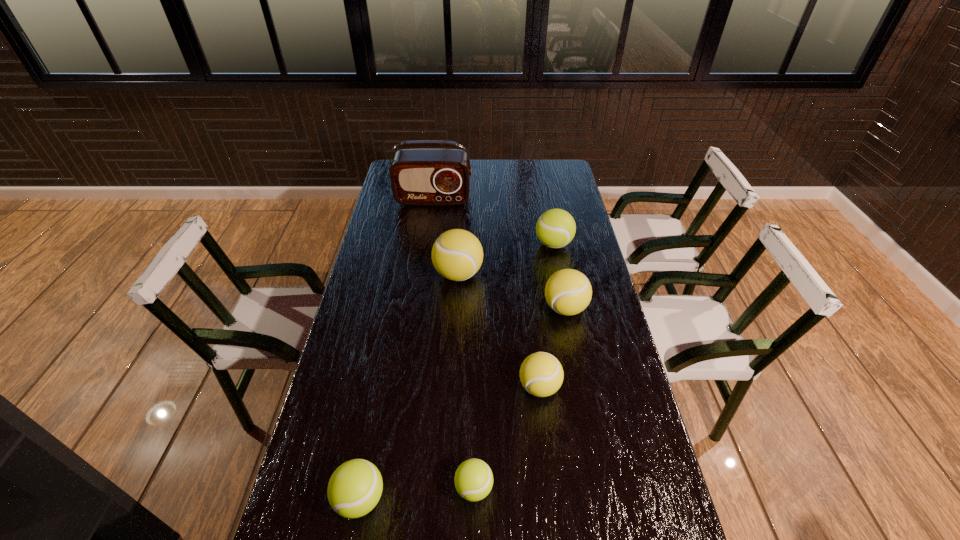
The image size is (960, 540). What are the coordinates of `vacant space situated on the right of the second green tennis ball from left to right` in the screenshot? It's located at (548, 488).

Locate an element on the screen. The height and width of the screenshot is (540, 960). radio receiver located in the left edge section of the desktop is located at coordinates (425, 177).

Find the location of a particular element. This screenshot has height=540, width=960. tennis ball that is positioned at the left edge is located at coordinates (354, 489).

The image size is (960, 540). I want to click on vacant space at the far edge of the desktop, so click(477, 175).

Locate an element on the screen. This screenshot has height=540, width=960. vacant space at the left edge is located at coordinates (401, 215).

Identify the location of vacant area at the right edge of the desktop. (621, 423).

In order to click on vacant area at the far right corner of the desktop in this screenshot , I will do `click(553, 167)`.

Where is `free spot between the leftmost green tennis ball and the tallest object`? free spot between the leftmost green tennis ball and the tallest object is located at coordinates (396, 349).

Locate an element on the screen. Image resolution: width=960 pixels, height=540 pixels. vacant space in between the leftmost tennis ball and the smallest yellow tennis ball is located at coordinates (450, 443).

Identify the location of free space between the smallest green tennis ball and the third nearest tennis ball. (507, 437).